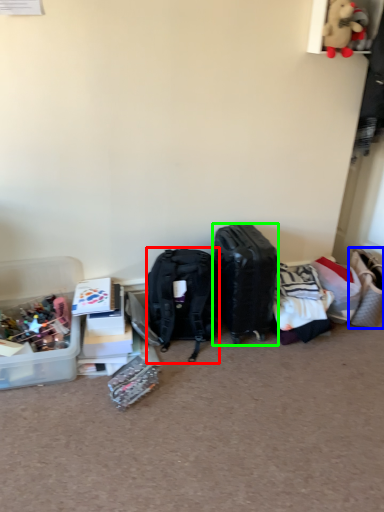
Question: Which object is positioned closest to backpack (highlighted by a red box)? Select from handbag (highlighted by a blue box) and luggage and bags (highlighted by a green box).

Choices:
 (A) handbag
 (B) luggage and bags

Answer: (B)